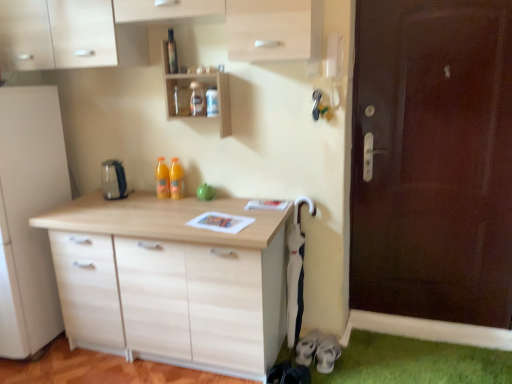
What do you see at coordinates (172, 53) in the screenshot? Image resolution: width=512 pixels, height=384 pixels. I see `transparent glass bottle at upper center, positioned as the 1th bottle in front-to-back order` at bounding box center [172, 53].

At what (x,y) coordinates should I click in order to perform the action: click on satin silver kettle at center. Please return your answer as a coordinate pair (x, y). Looking at the image, I should click on (113, 180).

How many degrees apart are the facing directions of wooden shelf at upper center and orange translucent bottle at center, the first bottle viewed from the left?

There is a 0.259-degree angle between the facing directions of wooden shelf at upper center and orange translucent bottle at center, the first bottle viewed from the left.

Is point (226, 95) closer or farther from the camera than point (169, 190)?

Point (226, 95) is closer to the camera than point (169, 190).

Is wooden shelf at upper center positioned far away from orange translucent bottle at center, the first bottle viewed from the left?

No, there isn't a large distance between wooden shelf at upper center and orange translucent bottle at center, the first bottle viewed from the left.

Is wooden shelf at upper center aimed at orange translucent bottle at center, marked as the 1th bottle in a bottom-to-top arrangement?

No, wooden shelf at upper center is not oriented towards orange translucent bottle at center, marked as the 1th bottle in a bottom-to-top arrangement.

Can you see orange translucent bottle at center, the 2th bottle when ordered from front to back, touching satin silver kettle at center?

No.

Does orange translucent bottle at center, the 2th bottle when ordered from right to left, have a smaller size compared to satin silver kettle at center?

Correct, orange translucent bottle at center, the 2th bottle when ordered from right to left, occupies less space than satin silver kettle at center.

How many degrees apart are the facing directions of orange translucent bottle at center, the 2th bottle when ordered from front to back, and satin silver kettle at center?

orange translucent bottle at center, the 2th bottle when ordered from front to back, and satin silver kettle at center are facing 0.000718 degrees away from each other.

From a real-world perspective, does orange translucent bottle at center, the 2th bottle when ordered from right to left, sit lower than satin silver kettle at center?

No.

From the image's perspective, is satin silver kettle at center above or below orange translucent bottle at center, which is the second bottle in top-to-bottom order?

Clearly, from the image's perspective, satin silver kettle at center is below orange translucent bottle at center, which is the second bottle in top-to-bottom order.

Looking at the image, does satin silver kettle at center seem bigger or smaller compared to orange translucent bottle at center, which is the second bottle in top-to-bottom order?

In the image, satin silver kettle at center appears to be larger than orange translucent bottle at center, which is the second bottle in top-to-bottom order.

How much distance is there between satin silver kettle at center and orange translucent bottle at center, the 2th bottle when ordered from front to back?

satin silver kettle at center and orange translucent bottle at center, the 2th bottle when ordered from front to back, are 10.00 inches apart.

You are a GUI agent. You are given a task and a screenshot of the screen. Output one action in this format:
    pyautogui.click(x=<x>, y=<y>)
    Task: Click on the appliance below the orange translucent bottle at center, the 2th bottle when ordered from front to back (from the image's perspective)
    
    Given the screenshot: What is the action you would take?
    pyautogui.click(x=113, y=180)

Would you say orange translucent bottle at center, the first bottle viewed from the left, is inside or outside wooden shelf at upper center?

The correct answer is: outside.

Based on the photo, which object is thinner, orange translucent bottle at center, which is the second bottle in top-to-bottom order, or wooden shelf at upper center?

Thinner between the two is orange translucent bottle at center, which is the second bottle in top-to-bottom order.

From the image's perspective, would you say orange translucent bottle at center, the 2th bottle when ordered from right to left, is positioned over wooden shelf at upper center?

Actually, orange translucent bottle at center, the 2th bottle when ordered from right to left, appears below wooden shelf at upper center in the image.

Does orange translucent bottle at center, which is the second bottle in top-to-bottom order, turn towards wooden shelf at upper center?

No, orange translucent bottle at center, which is the second bottle in top-to-bottom order, is not facing towards wooden shelf at upper center.

Where is `bottle to the right of orange translucent bottle at center, marked as the 1th bottle in a bottom-to-top arrangement`? This screenshot has height=384, width=512. bottle to the right of orange translucent bottle at center, marked as the 1th bottle in a bottom-to-top arrangement is located at coordinates (172, 53).

Is point (168, 177) closer to viewer compared to point (173, 69)?

That is False.

Is orange translucent bottle at center, the 2th bottle when ordered from front to back, outside of transparent glass bottle at upper center, acting as the 2th bottle starting from the bottom?

Yes, orange translucent bottle at center, the 2th bottle when ordered from front to back, is outside of transparent glass bottle at upper center, acting as the 2th bottle starting from the bottom.

From a real-world perspective, is orange translucent bottle at center, the 2th bottle when ordered from front to back, physically below transparent glass bottle at upper center, arranged as the first bottle when viewed from the right?

Correct, in the physical world, orange translucent bottle at center, the 2th bottle when ordered from front to back, is lower than transparent glass bottle at upper center, arranged as the first bottle when viewed from the right.

In the scene shown: Which is more to the left, transparent glass bottle at upper center, acting as the 2th bottle starting from the bottom, or wooden shelf at upper center?

Positioned to the left is transparent glass bottle at upper center, acting as the 2th bottle starting from the bottom.

Can you confirm if transparent glass bottle at upper center, marked as the second bottle in a left-to-right arrangement, is smaller than wooden shelf at upper center?

Correct, transparent glass bottle at upper center, marked as the second bottle in a left-to-right arrangement, occupies less space than wooden shelf at upper center.

Is transparent glass bottle at upper center, marked as the second bottle in a left-to-right arrangement, shorter than wooden shelf at upper center?

Yes.

In the scene shown: From the image's perspective, which is above, wooden shelf at upper center or transparent glass bottle at upper center, which ranks as the 1th bottle in top-to-bottom order?

transparent glass bottle at upper center, which ranks as the 1th bottle in top-to-bottom order, from the image's perspective.

How many degrees apart are the facing directions of wooden shelf at upper center and transparent glass bottle at upper center, which ranks as the 1th bottle in top-to-bottom order?

The angle between the facing direction of wooden shelf at upper center and the facing direction of transparent glass bottle at upper center, which ranks as the 1th bottle in top-to-bottom order, is 0.00083 degrees.

Considering the relative positions of wooden shelf at upper center and transparent glass bottle at upper center, arranged as the first bottle when viewed from the right, in the image provided, is wooden shelf at upper center to the right of transparent glass bottle at upper center, arranged as the first bottle when viewed from the right, from the viewer's perspective?

Yes.

Locate an element on the screen. shelf below the transparent glass bottle at upper center, arranged as the first bottle when viewed from the right (from the image's perspective) is located at coordinates (190, 95).

This screenshot has width=512, height=384. In the image, there is a wooden shelf at upper center. Find the location of `bottle below it (from the image's perspective)`. bottle below it (from the image's perspective) is located at coordinates (162, 179).

There is a satin silver kettle at center. Where is `the 1st bottle above it (from a real-world perspective)`? The height and width of the screenshot is (384, 512). the 1st bottle above it (from a real-world perspective) is located at coordinates (x=162, y=179).

In the scene shown: From the image, which object appears to be farther from orange translucent bottle at center, the first bottle viewed from the left, transparent glass bottle at upper center, positioned as the 1th bottle in front-to-back order, or wooden shelf at upper center?

transparent glass bottle at upper center, positioned as the 1th bottle in front-to-back order.

Which object lies further to the anchor point orange translucent bottle at center, which is the second bottle in top-to-bottom order, satin silver kettle at center or transparent glass bottle at upper center, positioned as the 1th bottle in front-to-back order?

Based on the image, transparent glass bottle at upper center, positioned as the 1th bottle in front-to-back order, appears to be further to orange translucent bottle at center, which is the second bottle in top-to-bottom order.

Which object lies nearer to the anchor point transparent glass bottle at upper center, acting as the 2th bottle starting from the bottom, satin silver kettle at center or orange translucent bottle at center, arranged as the 1th bottle when viewed from the back?

orange translucent bottle at center, arranged as the 1th bottle when viewed from the back, is positioned closer to the anchor transparent glass bottle at upper center, acting as the 2th bottle starting from the bottom.

Considering their positions, is transparent glass bottle at upper center, acting as the 2th bottle starting from the bottom, positioned closer to wooden shelf at upper center than satin silver kettle at center?

The object closer to wooden shelf at upper center is transparent glass bottle at upper center, acting as the 2th bottle starting from the bottom.

Looking at the image, which one is located closer to satin silver kettle at center, transparent glass bottle at upper center, the 2th bottle from the back, or orange translucent bottle at center, the first bottle viewed from the left?

orange translucent bottle at center, the first bottle viewed from the left.

Looking at the image, which one is located further to transparent glass bottle at upper center, positioned as the 1th bottle in front-to-back order, wooden shelf at upper center or satin silver kettle at center?

satin silver kettle at center lies further to transparent glass bottle at upper center, positioned as the 1th bottle in front-to-back order, than the other object.

Considering their positions, is wooden shelf at upper center positioned closer to transparent glass bottle at upper center, acting as the 2th bottle starting from the bottom, than orange translucent bottle at center, arranged as the 1th bottle when viewed from the back?

Among the two, wooden shelf at upper center is located nearer to transparent glass bottle at upper center, acting as the 2th bottle starting from the bottom.

Based on their spatial positions, is orange translucent bottle at center, the first bottle viewed from the left, or wooden shelf at upper center further from satin silver kettle at center?

wooden shelf at upper center.

This screenshot has width=512, height=384. In order to click on bottle between transparent glass bottle at upper center, the 2th bottle from the back, and satin silver kettle at center, in the vertical direction in this screenshot , I will do `click(162, 179)`.

At what (x,y) coordinates should I click in order to perform the action: click on shelf between transparent glass bottle at upper center, acting as the 2th bottle starting from the bottom, and satin silver kettle at center vertically. Please return your answer as a coordinate pair (x, y). Looking at the image, I should click on (190, 95).

Find the location of `shelf between transparent glass bottle at upper center, which ranks as the 1th bottle in top-to-bottom order, and orange translucent bottle at center, marked as the 1th bottle in a bottom-to-top arrangement, from top to bottom`. shelf between transparent glass bottle at upper center, which ranks as the 1th bottle in top-to-bottom order, and orange translucent bottle at center, marked as the 1th bottle in a bottom-to-top arrangement, from top to bottom is located at coordinates (190, 95).

Find the location of a particular element. bottle that lies between wooden shelf at upper center and satin silver kettle at center from top to bottom is located at coordinates (162, 179).